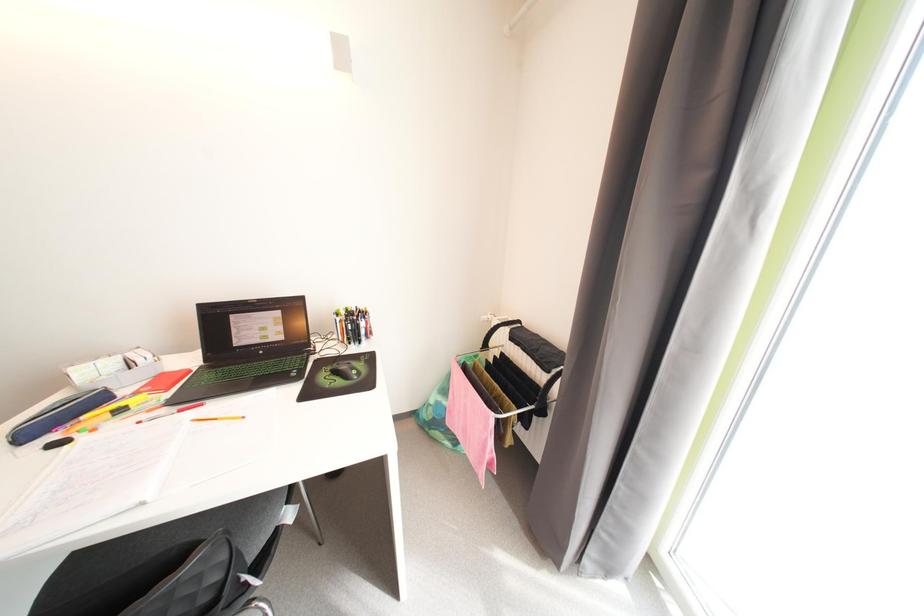
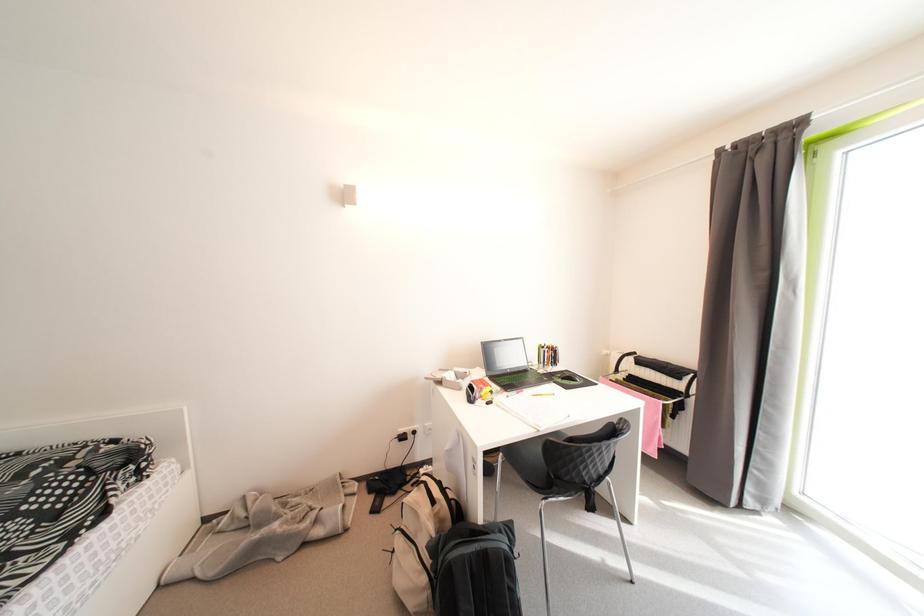
Which direction would the cameraman need to move to produce the second image?

The movement direction of the cameraman is left, backward.